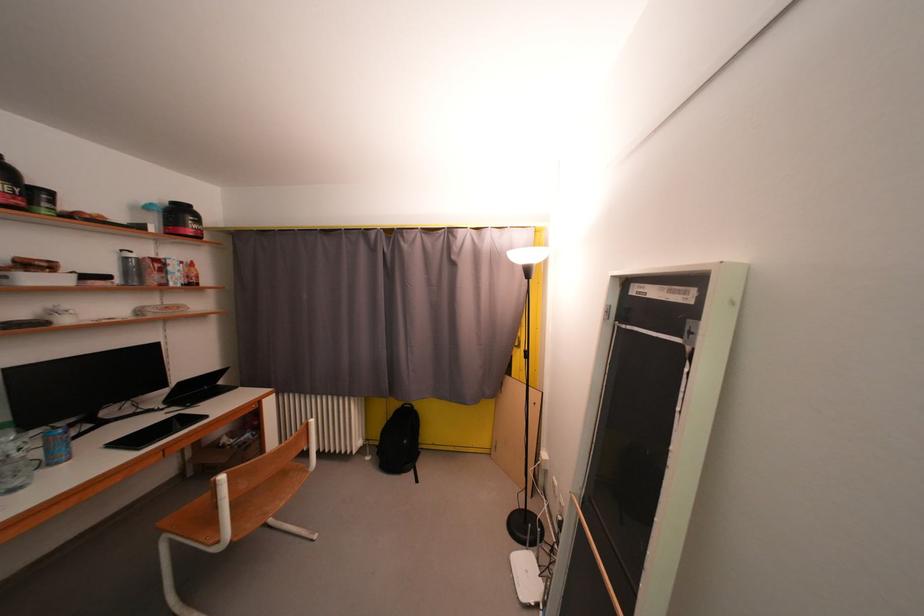
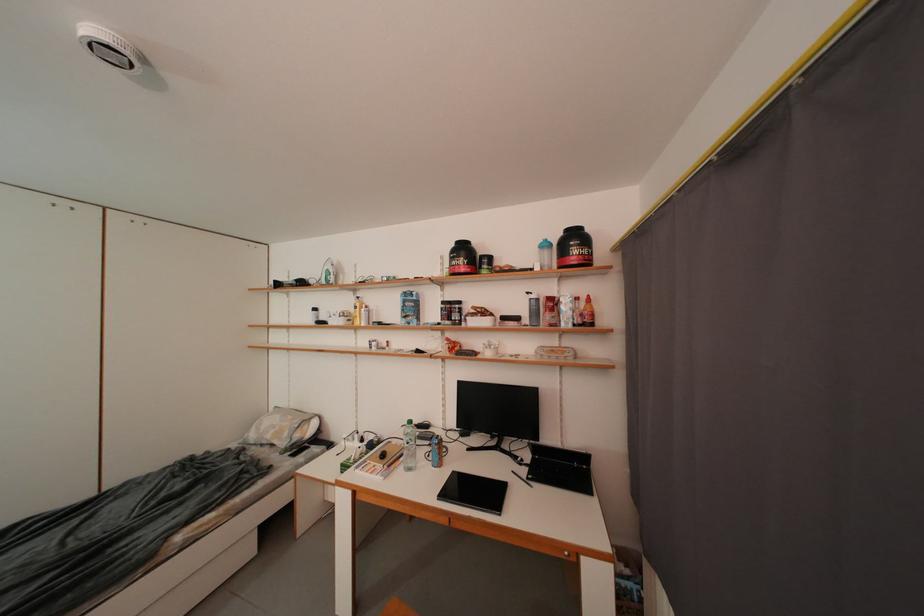
In the second image, find the point that corresponds to point (196, 281) in the first image.

(590, 318)